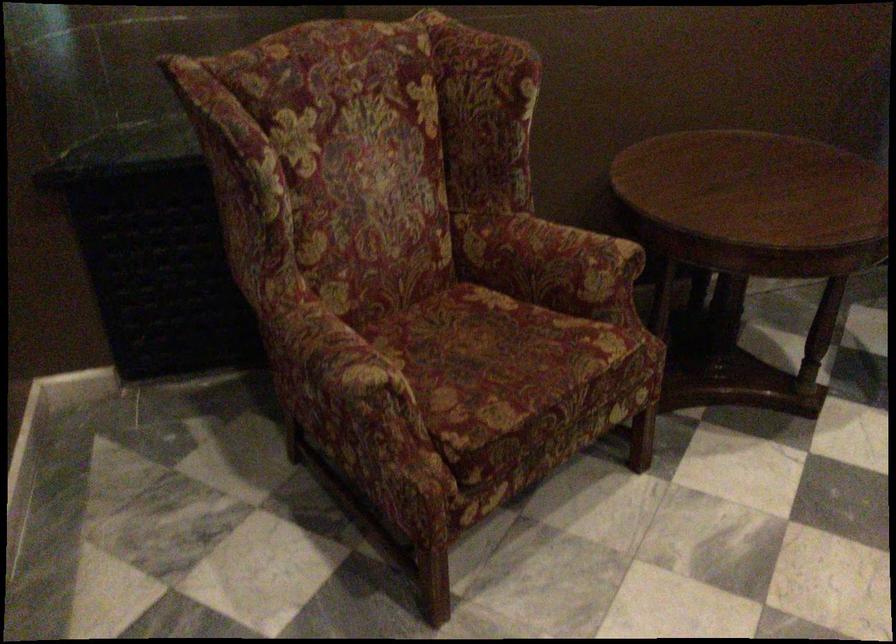
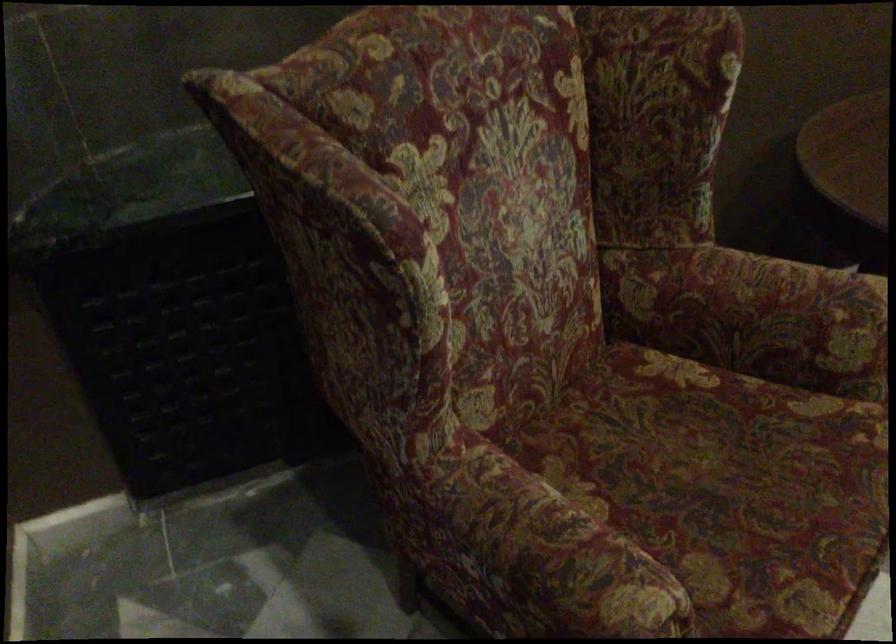
The images are taken continuously from a first-person perspective. In which direction are you moving?

The cameraman moved toward left, forward.